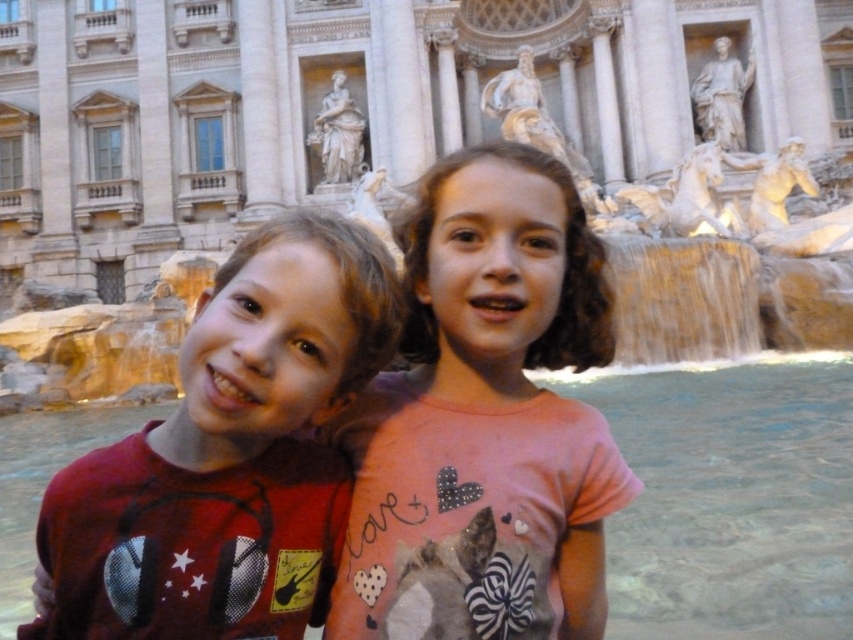
You are a photographer planning to take a photo of the stone marble palace at center and the matte red shirt at center. Based on their sizes in the image, which object should you focus on first if you want to ensure both are in focus?

The stone marble palace at center is much taller than the matte red shirt at center, so you should focus on the stone marble palace at center first to ensure both are in focus.

You are a tour guide leading a group to the stone marble palace at center. The group is currently standing 50 meters away from the palace. Can you inform them if they are already within the 50 meter safety zone required to view the palace from a safe distance?

The distance between the stone marble palace at center and the viewer is 55.66 meters, so the group is currently 5.66 meters beyond the 50 meter safety zone and needs to move 5.66 meters closer to enter the safety zone.